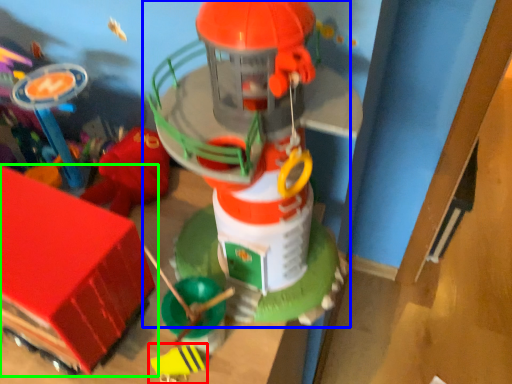
Question: Based on their relative distances, which object is farther from toy (highlighted by a red box)? Choose from toy (highlighted by a blue box) and toy (highlighted by a green box).

Choices:
 (A) toy
 (B) toy

Answer: (A)